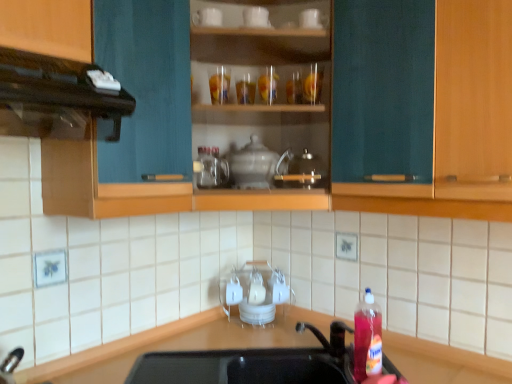
Question: Considering the relative positions of teal wood cabinet at center and black matte countertop at lower center in the image provided, is teal wood cabinet at center to the right of black matte countertop at lower center from the viewer's perspective?

Choices:
 (A) no
 (B) yes

Answer: (B)

Question: Is teal wood cabinet at center oriented towards black matte countertop at lower center?

Choices:
 (A) no
 (B) yes

Answer: (A)

Question: From the image's perspective, would you say teal wood cabinet at center is positioned over black matte countertop at lower center?

Choices:
 (A) yes
 (B) no

Answer: (A)

Question: Does teal wood cabinet at center have a smaller size compared to black matte countertop at lower center?

Choices:
 (A) yes
 (B) no

Answer: (A)

Question: Is teal wood cabinet at center closer to the viewer compared to black matte countertop at lower center?

Choices:
 (A) no
 (B) yes

Answer: (A)

Question: Does point (377, 357) appear closer or farther from the camera than point (464, 357)?

Choices:
 (A) farther
 (B) closer

Answer: (B)

Question: Choose the correct answer: Is translucent plastic bottle at lower right inside black matte countertop at lower center or outside it?

Choices:
 (A) inside
 (B) outside

Answer: (B)

Question: From a real-world perspective, is translucent plastic bottle at lower right positioned above or below black matte countertop at lower center?

Choices:
 (A) above
 (B) below

Answer: (A)

Question: Is translucent plastic bottle at lower right taller or shorter than black matte countertop at lower center?

Choices:
 (A) short
 (B) tall

Answer: (A)

Question: Is teal wood cabinet at center spatially inside black matte vent at upper left, or outside of it?

Choices:
 (A) inside
 (B) outside

Answer: (B)

Question: Relative to black matte vent at upper left, is teal wood cabinet at center in front or behind?

Choices:
 (A) behind
 (B) front

Answer: (A)

Question: In terms of size, does teal wood cabinet at center appear bigger or smaller than black matte vent at upper left?

Choices:
 (A) big
 (B) small

Answer: (A)

Question: Is point pos(457,125) positioned closer to the camera than point pos(125,99)?

Choices:
 (A) farther
 (B) closer

Answer: (A)

Question: Considering the relative positions of white ceramic mug at upper center, which appears as the 1th appliance when viewed from the front, and teal wood cabinet at center in the image provided, is white ceramic mug at upper center, which appears as the 1th appliance when viewed from the front, to the left or to the right of teal wood cabinet at center?

Choices:
 (A) left
 (B) right

Answer: (A)

Question: Looking at their shapes, would you say white ceramic mug at upper center, marked as the first appliance in a left-to-right arrangement, is wider or thinner than teal wood cabinet at center?

Choices:
 (A) thin
 (B) wide

Answer: (A)